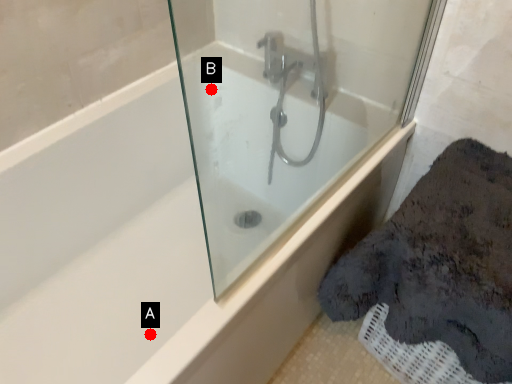
Question: Two points are circled on the image, labeled by A and B beside each circle. Which point is farther from the camera taking this photo?

Choices:
 (A) A is further
 (B) B is further

Answer: (B)